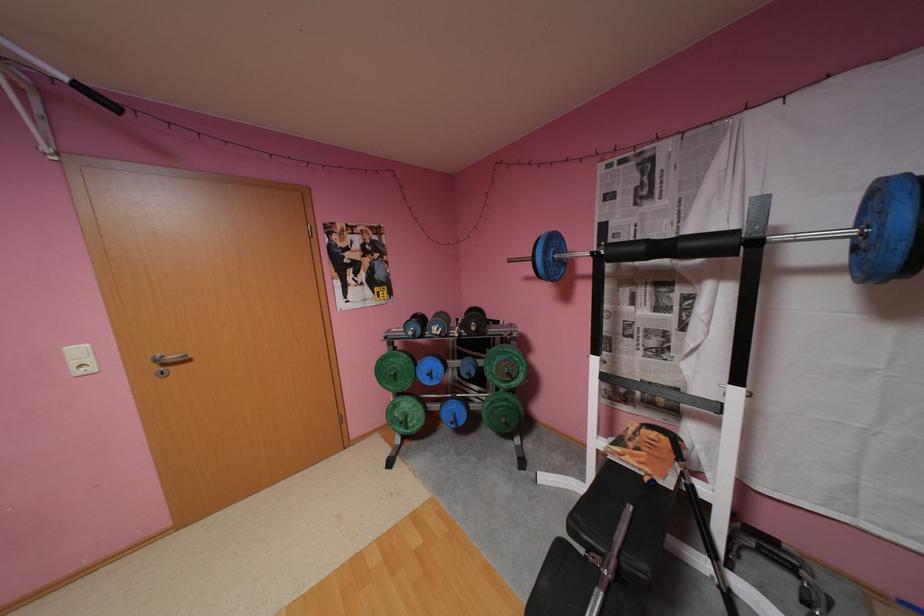
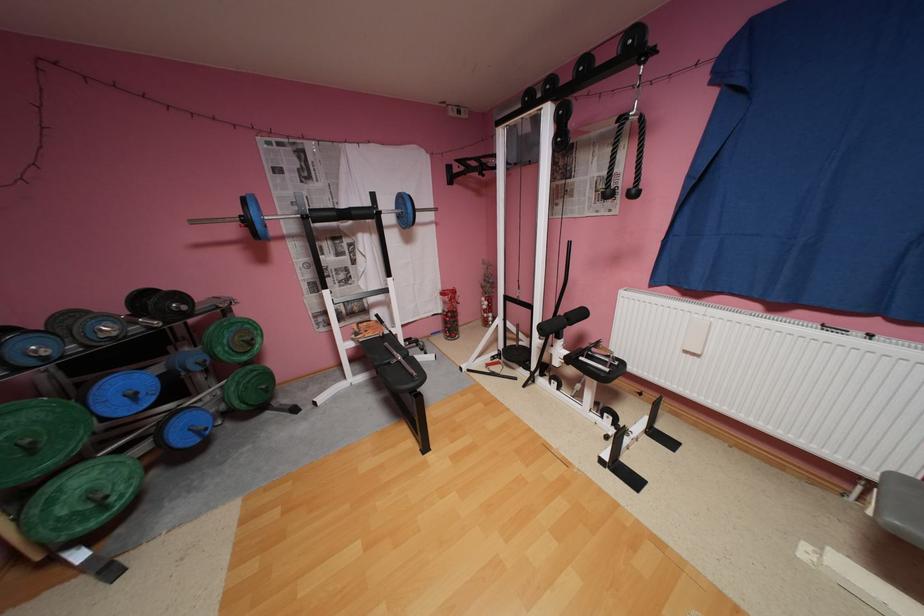
Where in the second image is the point corresponding to point (416, 427) from the first image?

(116, 508)